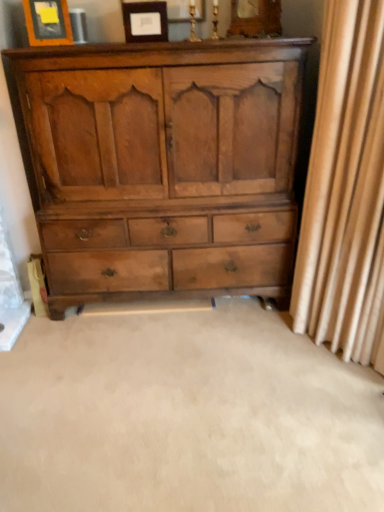
Question: Would you say beige fabric curtain at right is to the left or to the right of light brown wood chest of drawers at center in the picture?

Choices:
 (A) right
 (B) left

Answer: (A)

Question: Considering the positions of beige fabric curtain at right and light brown wood chest of drawers at center in the image, is beige fabric curtain at right taller or shorter than light brown wood chest of drawers at center?

Choices:
 (A) tall
 (B) short

Answer: (A)

Question: Which object is the closest to the light brown wood chest of drawers at center?

Choices:
 (A) matte wood picture frame at upper left, the first picture frame viewed from the left
 (B) beige fabric curtain at right
 (C) matte wood picture frame at upper center, which is the 2th picture frame in left-to-right order

Answer: (B)

Question: Which is nearer to the matte wood picture frame at upper center, which is the 2th picture frame in left-to-right order?

Choices:
 (A) matte wood picture frame at upper left, marked as the second picture frame in a right-to-left arrangement
 (B) beige fabric curtain at right
 (C) light brown wood chest of drawers at center

Answer: (A)